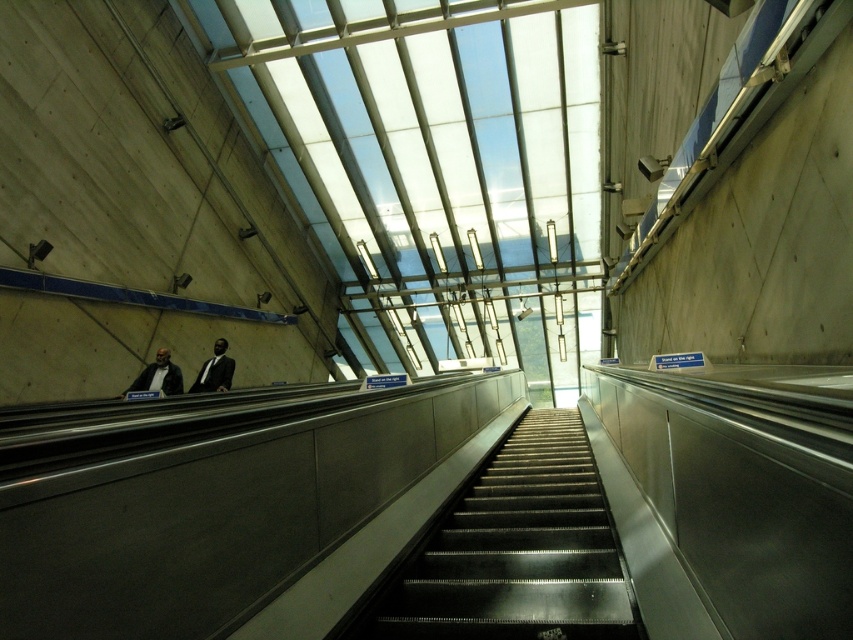
Question: Observing the image, what is the correct spatial positioning of matte black suit at center in reference to matte black suit at left?

Choices:
 (A) right
 (B) left

Answer: (B)

Question: Can you confirm if matte black suit at center is positioned to the left of matte black suit at left?

Choices:
 (A) yes
 (B) no

Answer: (A)

Question: From the image, what is the correct spatial relationship of metallic gray stairs at center in relation to matte black suit at left?

Choices:
 (A) below
 (B) above

Answer: (A)

Question: Which of these objects is positioned farthest from the metallic gray stairs at center?

Choices:
 (A) matte black suit at center
 (B) matte black suit at left

Answer: (B)

Question: Which of the following is the farthest from the observer?

Choices:
 (A) (155, 355)
 (B) (393, 627)
 (C) (204, 388)

Answer: (C)

Question: Which is farther from the metallic gray stairs at center?

Choices:
 (A) matte black suit at center
 (B) matte black suit at left

Answer: (B)